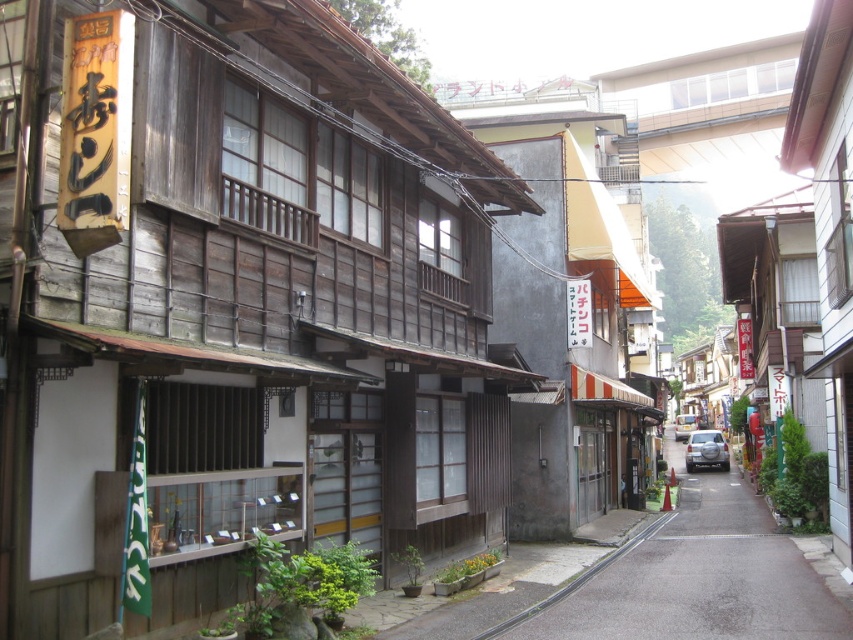
Is point (631, 592) in front of point (694, 467)?

That is True.

Is point (699, 564) less distant than point (703, 440)?

That is True.

Locate an element on the screen. smooth concrete pavement at center is located at coordinates coord(693,579).

Is silver metallic car at center shorter than metallic silver car at center?

In fact, silver metallic car at center may be taller than metallic silver car at center.

Can you confirm if silver metallic car at center is positioned below metallic silver car at center?

Incorrect, silver metallic car at center is not positioned below metallic silver car at center.

Is point (689, 436) farther from viewer compared to point (675, 435)?

No.

The image size is (853, 640). What are the coordinates of `silver metallic car at center` in the screenshot? It's located at (706, 449).

Can you confirm if smooth concrete pavement at center is positioned to the right of metallic silver car at center?

Incorrect, smooth concrete pavement at center is not on the right side of metallic silver car at center.

Does smooth concrete pavement at center lie in front of metallic silver car at center?

Yes, it is in front of metallic silver car at center.

Is point (706, 602) farther from camera compared to point (682, 413)?

No, (706, 602) is closer to viewer.

Locate an element on the screen. The image size is (853, 640). smooth concrete pavement at center is located at coordinates (693, 579).